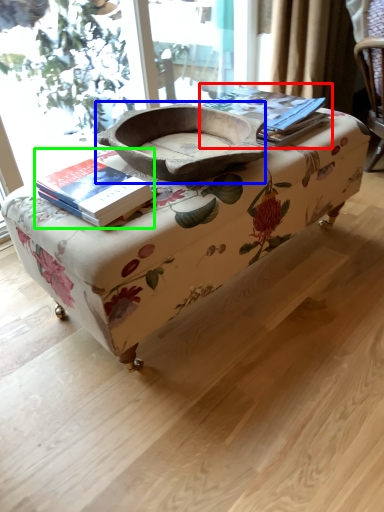
Question: Estimate the real-world distances between objects in this image. Which object is closer to paperback book (highlighted by a red box), bowl (highlighted by a blue box) or book (highlighted by a green box)?

Choices:
 (A) bowl
 (B) book

Answer: (A)